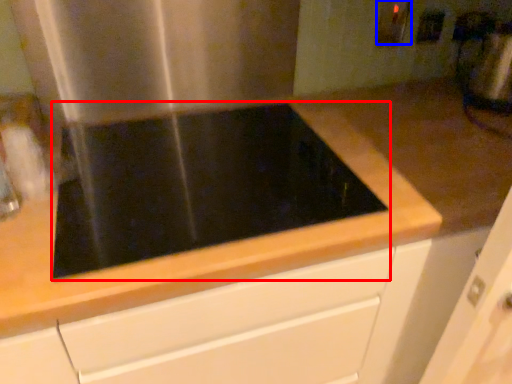
Question: Which of the following is the closest to the observer, gas stove (highlighted by a red box) or electric outlet (highlighted by a blue box)?

Choices:
 (A) gas stove
 (B) electric outlet

Answer: (A)